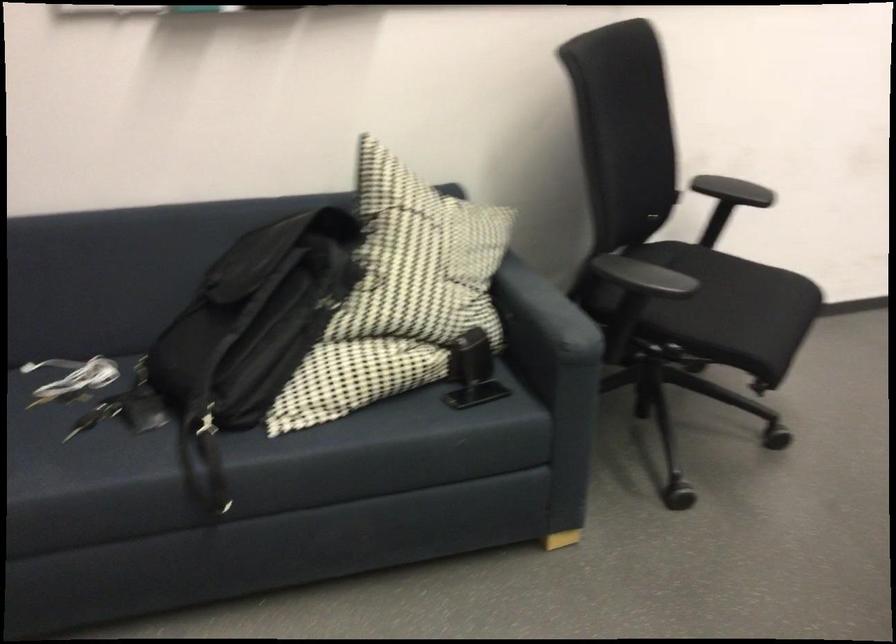
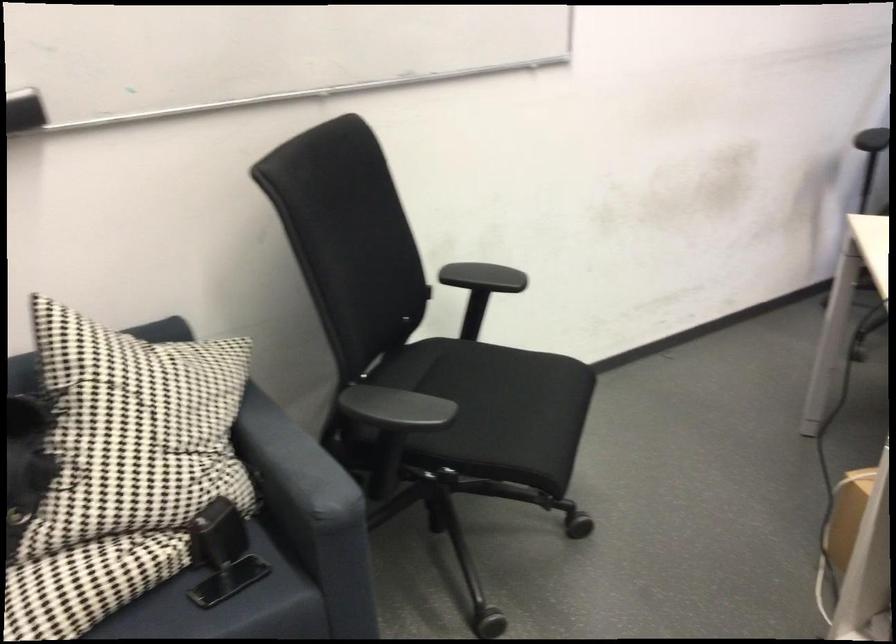
Where in the second image is the point corresponding to the point at 727,305 from the first image?

(495, 409)